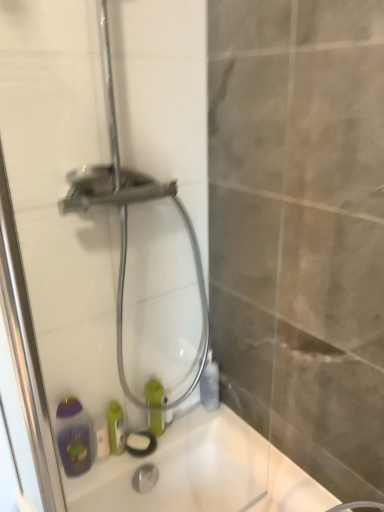
This screenshot has height=512, width=384. I want to click on free space in front of white matte soap bar at lower left, so click(93, 482).